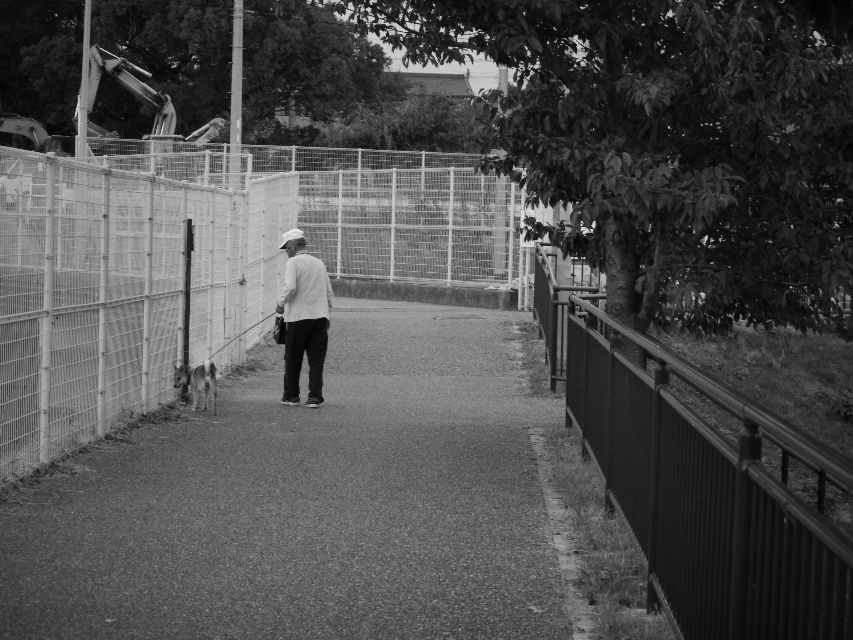
Question: Among these points, which one is nearest to the camera?

Choices:
 (A) pos(553,364)
 (B) pos(308,508)
 (C) pos(129,204)

Answer: (B)

Question: Is smooth asphalt pavement at center smaller than smooth metal fence at right?

Choices:
 (A) yes
 (B) no

Answer: (A)

Question: Which point is closer to the camera taking this photo?

Choices:
 (A) (764, 522)
 (B) (62, 292)
 (C) (334, 384)

Answer: (A)

Question: Can you confirm if smooth asphalt pavement at center is wider than white matte shirt at center?

Choices:
 (A) no
 (B) yes

Answer: (B)

Question: Estimate the real-world distances between objects in this image. Which object is closer to the smooth metal fence at right?

Choices:
 (A) smooth asphalt pavement at center
 (B) white matte shirt at center

Answer: (A)

Question: Does metallic wire mesh fence at left appear on the left side of white matte shirt at center?

Choices:
 (A) no
 (B) yes

Answer: (B)